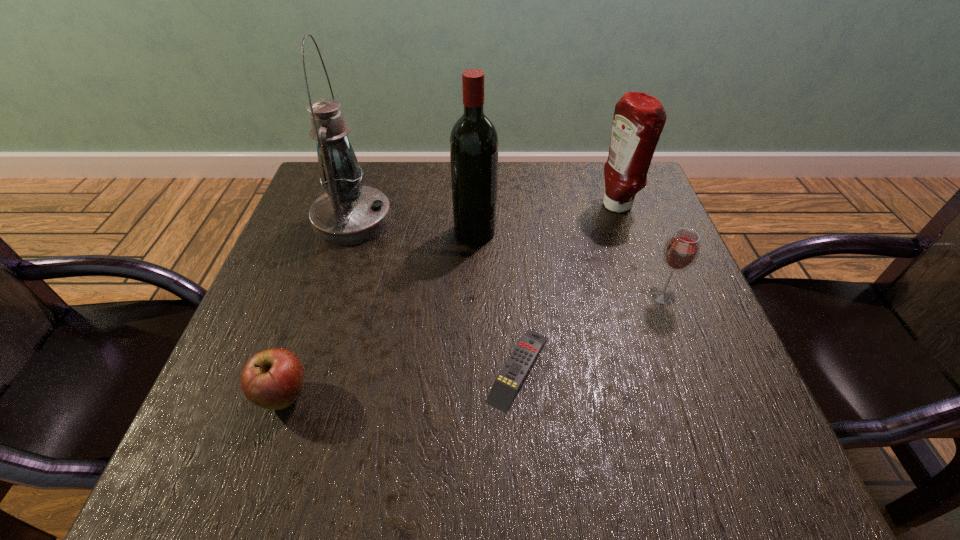
Find the location of a particular element. The width and height of the screenshot is (960, 540). free space located 0.210m on the front of the fourth farthest object is located at coordinates (704, 403).

The image size is (960, 540). What are the coordinates of `vacant region located on the right of the second shortest object` in the screenshot? It's located at (377, 396).

Identify the location of vacant space located on the left of the shortest object. This screenshot has height=540, width=960. (451, 368).

Find the location of a particular element. The width and height of the screenshot is (960, 540). oil lamp that is positioned at the far edge is located at coordinates (349, 213).

Where is `condiment located in the far edge section of the desktop`? Image resolution: width=960 pixels, height=540 pixels. condiment located in the far edge section of the desktop is located at coordinates (639, 118).

Find the location of `oil lamp that is at the left edge`. oil lamp that is at the left edge is located at coordinates (349, 213).

You are a GUI agent. You are given a task and a screenshot of the screen. Output one action in this format:
    pyautogui.click(x=<x>, y=<y>)
    Task: Click on the apple that is at the left edge
    The height and width of the screenshot is (540, 960).
    Given the screenshot: What is the action you would take?
    pyautogui.click(x=272, y=379)

I want to click on condiment that is at the right edge, so click(639, 118).

This screenshot has width=960, height=540. What are the coordinates of `wineglass located in the right edge section of the desktop` in the screenshot? It's located at (681, 251).

Where is `object positioned at the far left corner`? object positioned at the far left corner is located at coordinates (349, 213).